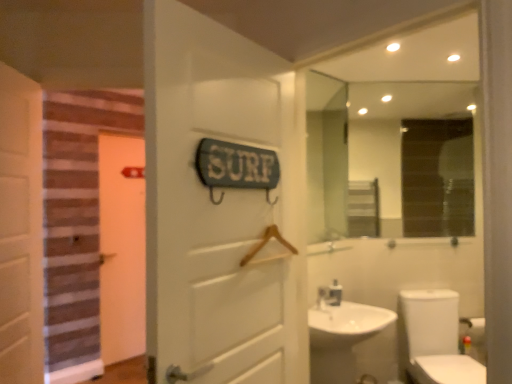
Question: Does orange matte door at left, the 1th door viewed from the back, have a smaller size compared to white glossy faucet at sink right?

Choices:
 (A) yes
 (B) no

Answer: (B)

Question: Does orange matte door at left, the 3th door positioned from the right, lie in front of white glossy faucet at sink right?

Choices:
 (A) yes
 (B) no

Answer: (B)

Question: Does orange matte door at left, the first door viewed from the left, turn towards white glossy faucet at sink right?

Choices:
 (A) no
 (B) yes

Answer: (B)

Question: Is orange matte door at left, the 3th door positioned from the front, positioned behind white glossy faucet at sink right?

Choices:
 (A) no
 (B) yes

Answer: (B)

Question: Is orange matte door at left, the 3th door positioned from the right, positioned beyond the bounds of white glossy faucet at sink right?

Choices:
 (A) yes
 (B) no

Answer: (A)

Question: Considering the positions of clear glass mirror at upper center and white glossy faucet at sink right in the image, is clear glass mirror at upper center wider or thinner than white glossy faucet at sink right?

Choices:
 (A) thin
 (B) wide

Answer: (A)

Question: Is clear glass mirror at upper center taller or shorter than white glossy faucet at sink right?

Choices:
 (A) tall
 (B) short

Answer: (A)

Question: From a real-world perspective, relative to white glossy faucet at sink right, is clear glass mirror at upper center vertically above or below?

Choices:
 (A) above
 (B) below

Answer: (A)

Question: Is clear glass mirror at upper center situated inside white glossy faucet at sink right or outside?

Choices:
 (A) inside
 (B) outside

Answer: (B)

Question: Is white glossy toilet at lower right inside the boundaries of clear glass mirror at upper center, or outside?

Choices:
 (A) outside
 (B) inside

Answer: (A)

Question: From the image's perspective, is white glossy toilet at lower right positioned above or below clear glass mirror at upper center?

Choices:
 (A) above
 (B) below

Answer: (B)

Question: Considering their positions, is white glossy toilet at lower right located in front of or behind clear glass mirror at upper center?

Choices:
 (A) front
 (B) behind

Answer: (A)

Question: From a real-world perspective, is white glossy toilet at lower right above or below clear glass mirror at upper center?

Choices:
 (A) below
 (B) above

Answer: (A)

Question: From the image's perspective, is white glossy toilet at lower right located above or below white wooden door at left, the 2th door viewed from the left?

Choices:
 (A) below
 (B) above

Answer: (A)

Question: From a real-world perspective, relative to white wooden door at left, which ranks as the second door in right-to-left order, is white glossy toilet at lower right vertically above or below?

Choices:
 (A) below
 (B) above

Answer: (A)